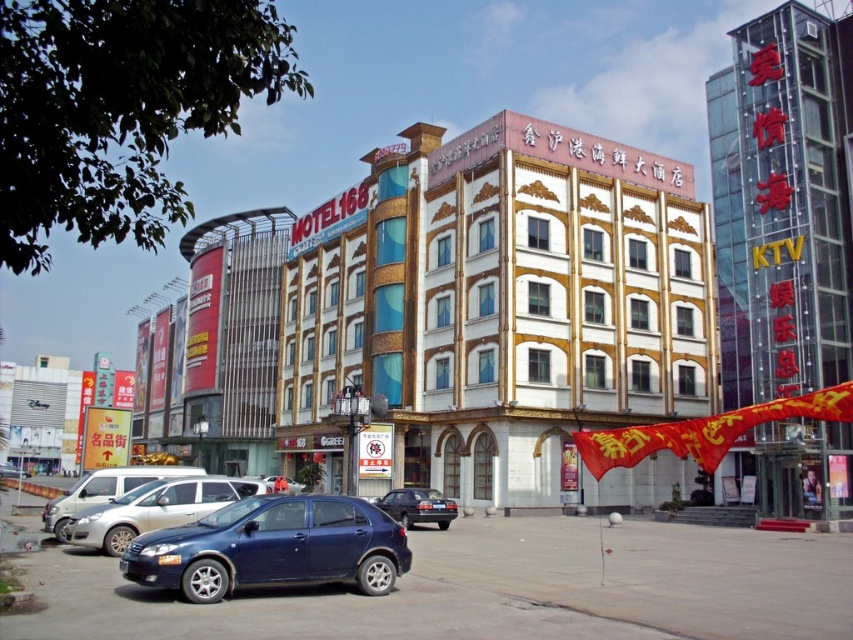
Question: Where is metallic silver sedan at lower left located in relation to dark blue metallic car at center in the image?

Choices:
 (A) left
 (B) right

Answer: (A)

Question: Which object is positioned farthest from the gold mosaic building at right?

Choices:
 (A) metallic blue sedan at center
 (B) dark blue metallic car at center

Answer: (A)

Question: Is satin blue hatchback at lower left smaller than dark blue metallic car at center?

Choices:
 (A) no
 (B) yes

Answer: (A)

Question: Is white glossy building at center to the left of metallic blue sedan at center from the viewer's perspective?

Choices:
 (A) no
 (B) yes

Answer: (A)

Question: Among these objects, which one is farthest from the camera?

Choices:
 (A) gold mosaic building at right
 (B) satin blue sedan at lower left

Answer: (A)

Question: Among these objects, which one is farthest from the camera?

Choices:
 (A) white glossy building at center
 (B) dark blue metallic car at center
 (C) satin blue sedan at lower left

Answer: (A)